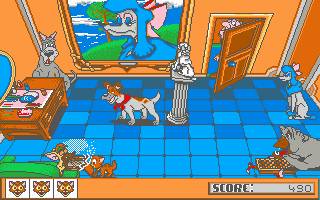
Image resolution: width=320 pixels, height=200 pixels. Find the location of `mirror`. mirror is located at coordinates (2, 65).